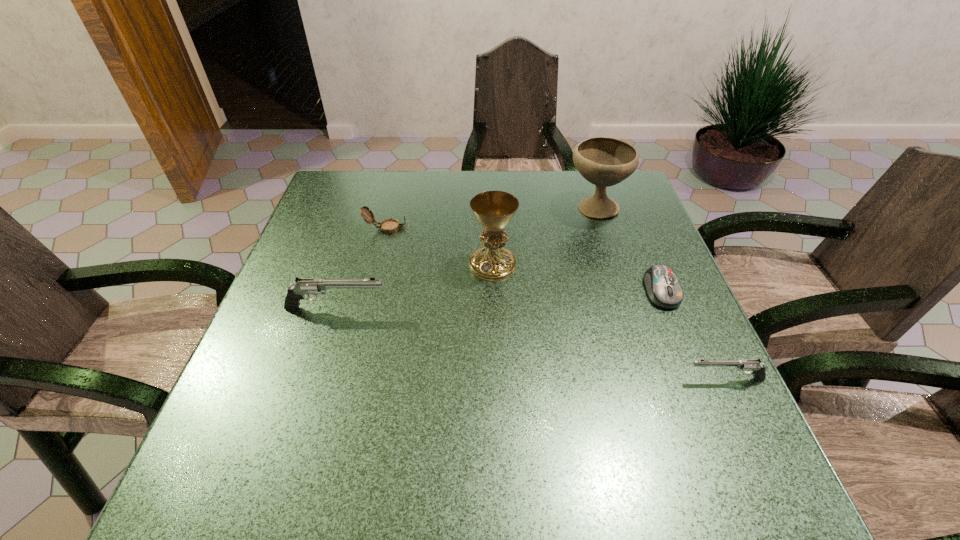
You are a GUI agent. You are given a task and a screenshot of the screen. Output one action in this format:
    pyautogui.click(x=<x>, y=<y>)
    Task: Click on the fourth shortest object
    
    Given the screenshot: What is the action you would take?
    point(304,286)

This screenshot has height=540, width=960. In order to click on the farther pistol in this screenshot , I will do `click(304, 286)`.

Where is `the nearest object`? The image size is (960, 540). the nearest object is located at coordinates (754, 367).

Locate an element on the screen. This screenshot has height=540, width=960. the right pistol is located at coordinates (754, 367).

Where is `the right chalice`? The height and width of the screenshot is (540, 960). the right chalice is located at coordinates (602, 161).

Where is `the nearer chalice`? Image resolution: width=960 pixels, height=540 pixels. the nearer chalice is located at coordinates coord(494,210).

Identify the location of the third object from left to right. (494, 210).

This screenshot has height=540, width=960. I want to click on compass, so click(388, 226).

At what (x,y) coordinates should I click in order to perform the action: click on computer mouse. Please return your answer as a coordinate pair (x, y). This screenshot has height=540, width=960. Looking at the image, I should click on (663, 288).

Locate an element on the screen. This screenshot has width=960, height=540. vacant area located 0.060m on the front-facing side of the third tallest object is located at coordinates (415, 308).